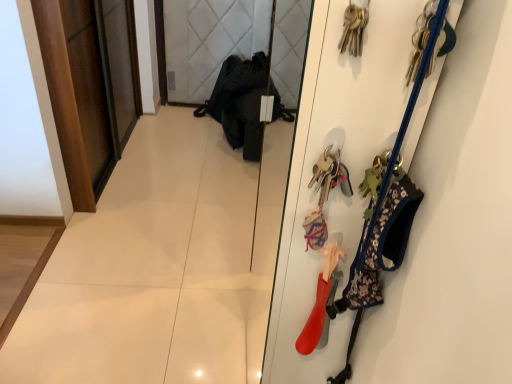
This screenshot has height=384, width=512. In order to click on free space in front of clear glass mirror at center in this screenshot , I will do `click(228, 266)`.